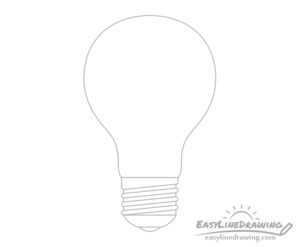
I want to click on empty space to the right of bulb, so click(x=201, y=129).